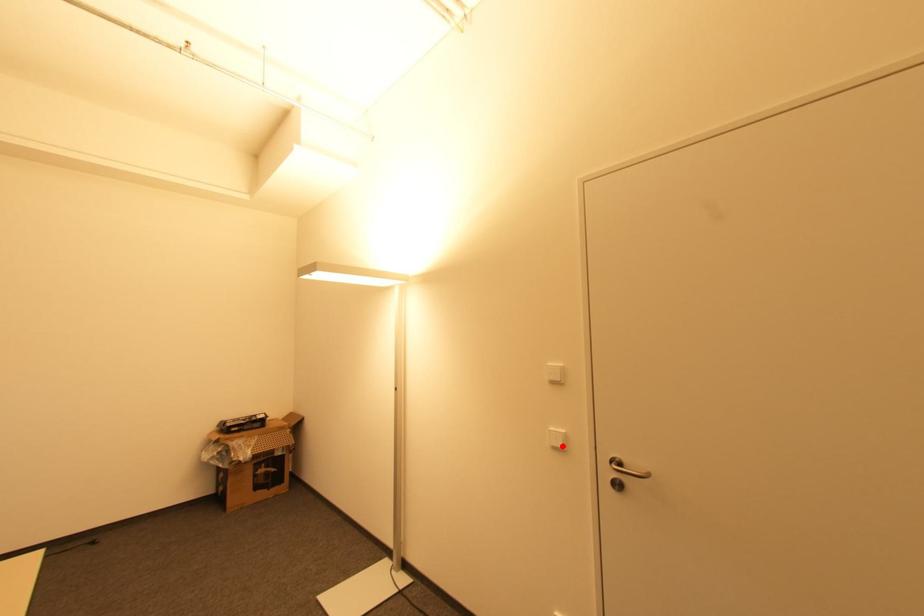
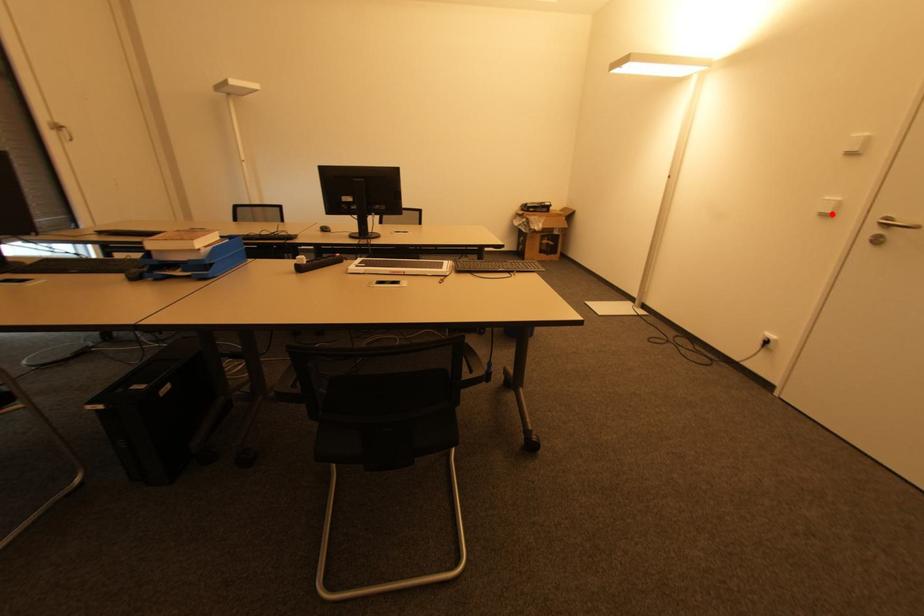
I am providing you with two images of the same scene from different viewpoints. A red point is marked on the first image and another point is marked on the second image. Is the red point in image1 aligned with the point shown in image2?

Yes